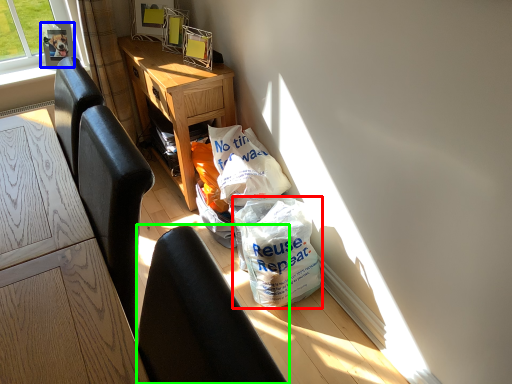
Question: Based on their relative distances, which object is nearer to plastic bag (highlighted by a red box)? Choose from picture frame (highlighted by a blue box) and chair (highlighted by a green box).

Choices:
 (A) picture frame
 (B) chair

Answer: (B)